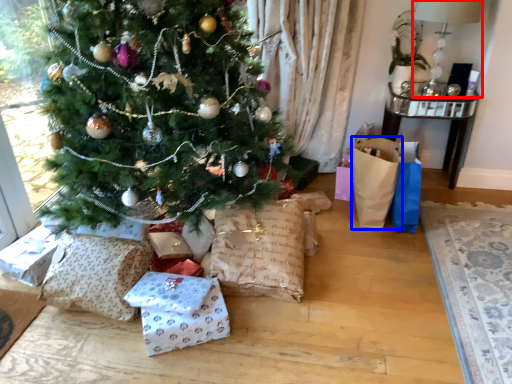
Question: Which point is further to the camera, lamp (highlighted by a red box) or gift bag (highlighted by a blue box)?

Choices:
 (A) lamp
 (B) gift bag

Answer: (A)